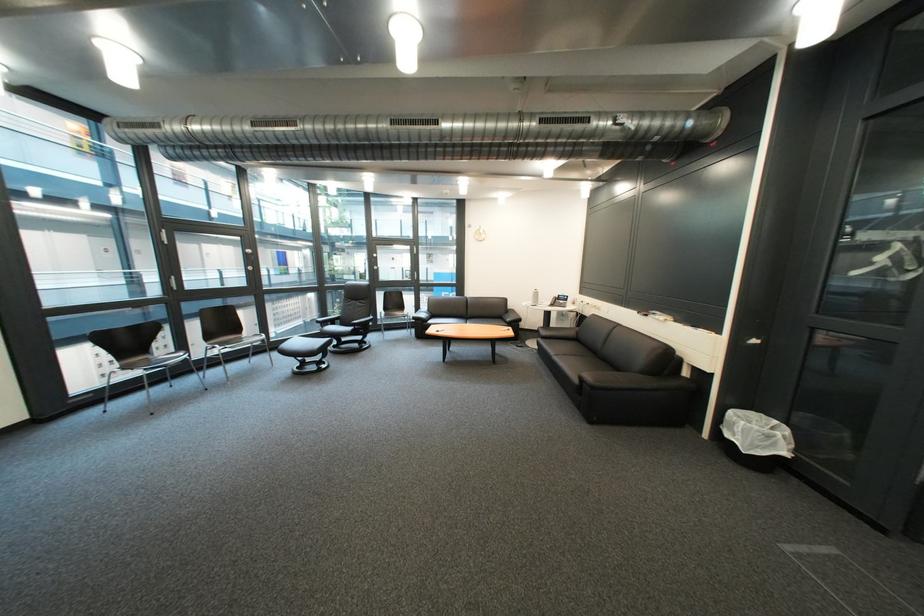
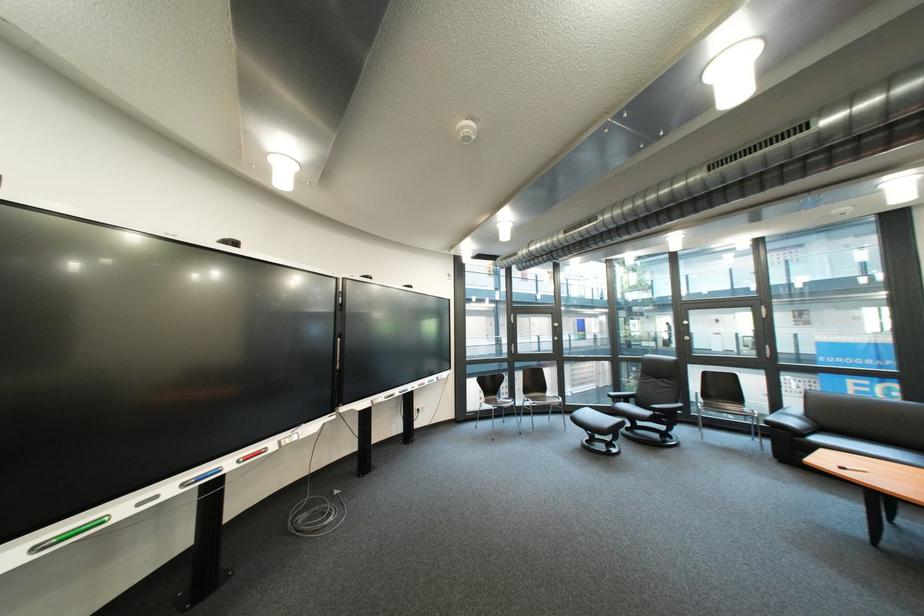
The point at (x=185, y=387) is marked in the first image. Where is the corresponding point in the second image?

(517, 424)